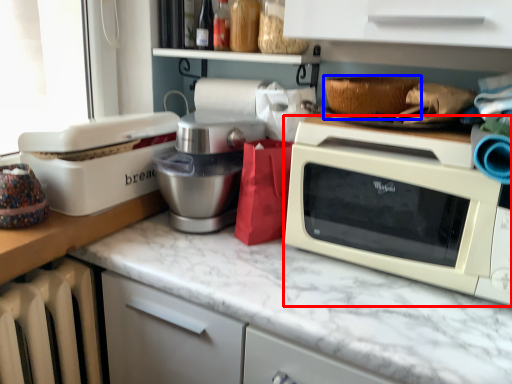
Question: Which point is closer to the camera, microwave oven (highlighted by a red box) or basket (highlighted by a blue box)?

Choices:
 (A) microwave oven
 (B) basket

Answer: (A)